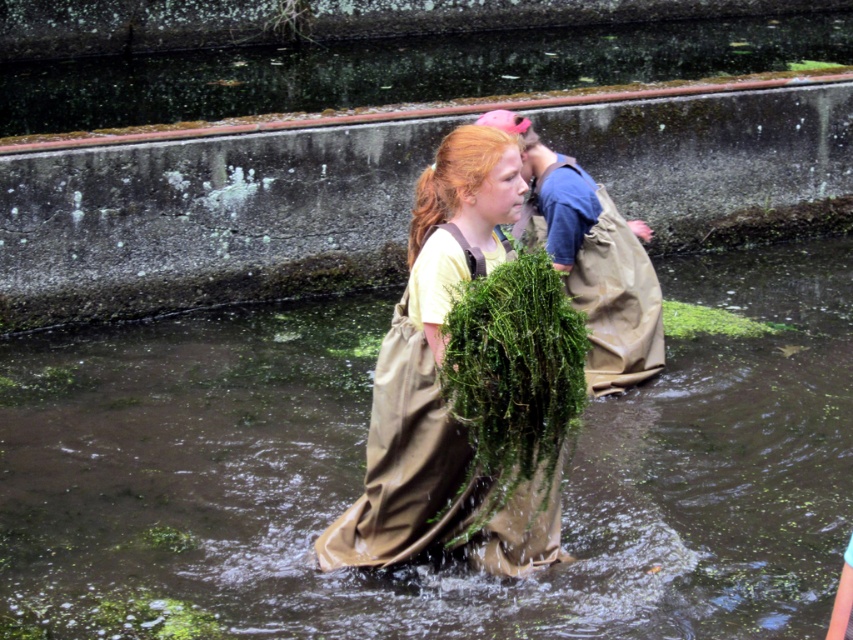
You are a delivery drone flying above the canal. You need to drop a package into the matte brown bag at center without hitting the green leafy plant at center. Based on their positions, where should you aim your drop?

The matte brown bag at center is located below the green leafy plant at center, so you should aim your drop slightly below the green leafy plant at center to ensure the package lands in the matte brown bag at center without hitting the plant.

You are a researcher studying water quality. You observe the matte brown bag at center and the green leafy algae at center in the canal. Which object is taller when viewed from above?

The matte brown bag at center is taller than the green leafy algae at center.

You are a delivery drone that needs to drop a package between the matte brown bag at center and the green leafy plant at center. The minimum safe distance for dropping is 12 feet. Can you safely drop the package between them?

The distance between the matte brown bag at center and the green leafy plant at center is 11.97 feet, which is less than the required 12 feet minimum safe distance. Therefore, you cannot safely drop the package between them.